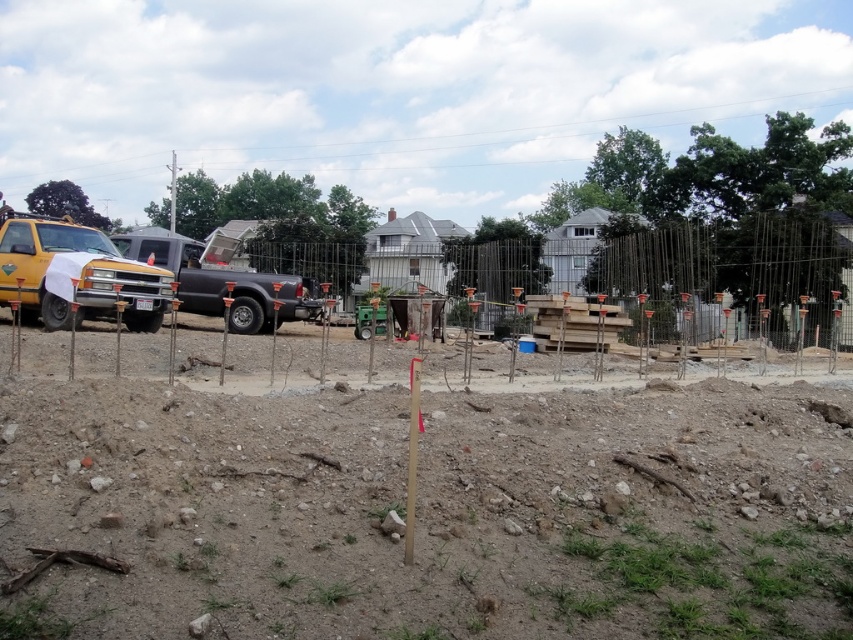
Question: Is matte yellow truck at left closer to camera compared to black matte truck at center?

Choices:
 (A) no
 (B) yes

Answer: (A)

Question: Observing the image, what is the correct spatial positioning of brown sandy soil at center in reference to matte yellow truck at left?

Choices:
 (A) above
 (B) below

Answer: (B)

Question: Which object is positioned closest to the black matte truck at center?

Choices:
 (A) brown sandy soil at center
 (B) matte yellow truck at left

Answer: (B)

Question: Which object appears closest to the camera in this image?

Choices:
 (A) brown sandy soil at center
 (B) black matte truck at center

Answer: (A)

Question: Does brown sandy soil at center lie in front of matte yellow truck at left?

Choices:
 (A) yes
 (B) no

Answer: (A)

Question: Which object is closer to the camera taking this photo?

Choices:
 (A) black matte truck at center
 (B) matte yellow truck at left
 (C) brown sandy soil at center

Answer: (C)